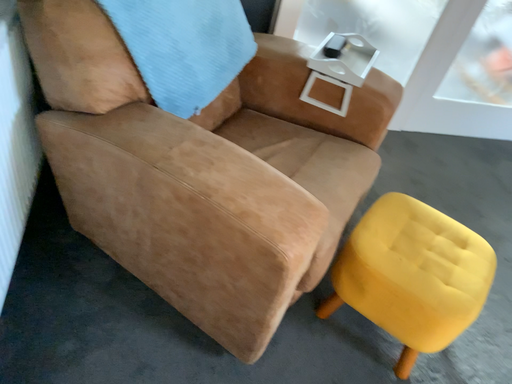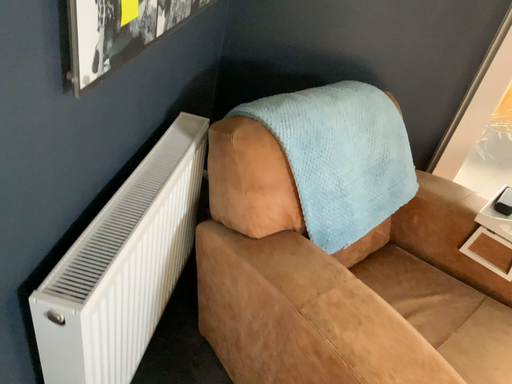
Question: Which way did the camera rotate in the video?

Choices:
 (A) rotated left
 (B) rotated right

Answer: (A)